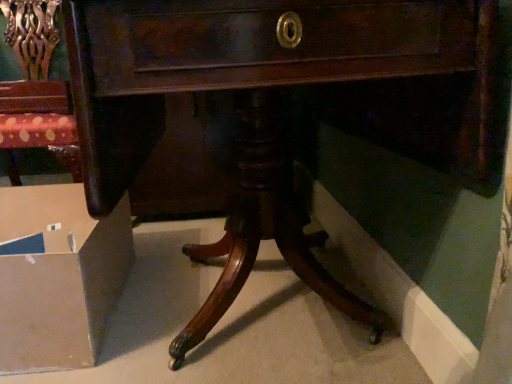
Describe the element at coordinates (32, 36) in the screenshot. The height and width of the screenshot is (384, 512). I see `polished wood chair at upper left` at that location.

Identify the location of polished wood chair at upper left. (32, 36).

In order to face polished wood chair at upper left, should I rotate leftwards or rightwards?

To align with it, rotate left about 28.940°.

In order to click on cardboard box at lower left in this screenshot , I will do `click(58, 277)`.

Describe the element at coordinates (58, 277) in the screenshot. The image size is (512, 384). I see `cardboard box at lower left` at that location.

The width and height of the screenshot is (512, 384). What are the coordinates of `polished wood chair at upper left` in the screenshot? It's located at (32, 36).

Is polished wood chair at upper left at the right side of cardboard box at lower left?

Incorrect, polished wood chair at upper left is not on the right side of cardboard box at lower left.

Is polished wood chair at upper left further to the viewer compared to cardboard box at lower left?

Yes.

Which point is more distant from viewer, (19, 123) or (48, 185)?

The point (19, 123) is behind.

From the image's perspective, would you say polished wood chair at upper left is shown under cardboard box at lower left?

No, from the image's perspective, polished wood chair at upper left is not beneath cardboard box at lower left.

From a real-world perspective, is polished wood chair at upper left beneath cardboard box at lower left?

No, from a real-world perspective, polished wood chair at upper left is not under cardboard box at lower left.

Considering the relative sizes of polished wood chair at upper left and cardboard box at lower left in the image provided, is polished wood chair at upper left thinner than cardboard box at lower left?

Indeed, polished wood chair at upper left has a lesser width compared to cardboard box at lower left.

Between polished wood chair at upper left and cardboard box at lower left, which one has less height?

With less height is cardboard box at lower left.

Looking at this image, which of these two, polished wood chair at upper left or cardboard box at lower left, is bigger?

Bigger between the two is polished wood chair at upper left.

Is cardboard box at lower left surrounded by polished wood chair at upper left?

No.

Would you say polished wood chair at upper left is a long distance from cardboard box at lower left?

No, polished wood chair at upper left is not far from cardboard box at lower left.

Is polished wood chair at upper left positioned with its back to cardboard box at lower left?

No, cardboard box at lower left is not at the back of polished wood chair at upper left.

Measure the distance between polished wood chair at upper left and cardboard box at lower left.

polished wood chair at upper left and cardboard box at lower left are 21.91 inches apart from each other.

What are the coordinates of `chair above the cardboard box at lower left (from the image's perspective)` in the screenshot? It's located at (32, 36).

Considering the relative positions of cardboard box at lower left and polished wood chair at upper left in the image provided, is cardboard box at lower left to the right of polished wood chair at upper left from the viewer's perspective?

Yes.

Is the depth of cardboard box at lower left greater than that of polished wood chair at upper left?

No.

Between point (38, 233) and point (49, 23), which one is positioned behind?

The point (49, 23) is farther from the camera.

From the image's perspective, is cardboard box at lower left located above polished wood chair at upper left?

No, from the image's perspective, cardboard box at lower left is not over polished wood chair at upper left.

From the picture: From a real-world perspective, between cardboard box at lower left and polished wood chair at upper left, who is vertically higher?

In real-world perspective, polished wood chair at upper left is above.

Looking at their sizes, would you say cardboard box at lower left is wider or thinner than polished wood chair at upper left?

Clearly, cardboard box at lower left has more width compared to polished wood chair at upper left.

Can you confirm if cardboard box at lower left is taller than polished wood chair at upper left?

No, cardboard box at lower left is not taller than polished wood chair at upper left.

In the scene shown: Can you confirm if cardboard box at lower left is bigger than polished wood chair at upper left?

No, cardboard box at lower left is not bigger than polished wood chair at upper left.

Which is correct: cardboard box at lower left is inside polished wood chair at upper left, or outside of it?

cardboard box at lower left is not inside polished wood chair at upper left, it's outside.

Are cardboard box at lower left and polished wood chair at upper left far apart?

No, cardboard box at lower left is in close proximity to polished wood chair at upper left.

Could you tell me if cardboard box at lower left is turned towards polished wood chair at upper left?

No, cardboard box at lower left is not facing towards polished wood chair at upper left.

At what (x,y) coordinates should I click in order to perform the action: click on cardboard box below the polished wood chair at upper left (from the image's perspective). Please return your answer as a coordinate pair (x, y). Looking at the image, I should click on (58, 277).

Identify the location of chair on the left of cardboard box at lower left. This screenshot has height=384, width=512. (32, 36).

Where is `cardboard box beneath the polished wood chair at upper left (from a real-world perspective)`? cardboard box beneath the polished wood chair at upper left (from a real-world perspective) is located at coordinates (58, 277).